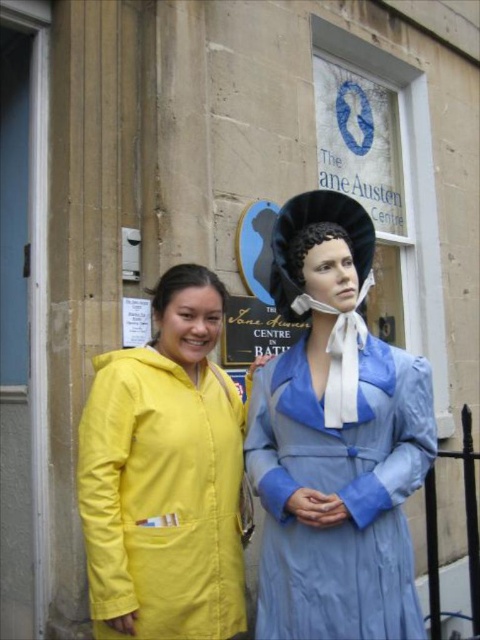
Consider the image. You are a tour guide at the Jane Austen Centre and need to direct visitors to the entrance. The entrance is located at point (165, 476). Where is the entrance located in relation to the yellow matte coat at center?

The entrance is located at the yellow matte coat at center, as point (165, 476) corresponds to the yellow matte coat at center.

In the scene shown: You are a tour guide at the Jane Austen Centre and need to point out the yellow matte coat at center to a visitor. Where exactly should you direct their attention using coordinates?

The yellow matte coat at center is located at coordinates point (x=165, y=476).

You are a costume designer preparing for a play. You need to decide which of the two outfits, the yellow matte coat at center or the light blue satin dress at center, would be more suitable for a character who needs to move freely in a scene involving quick movements. Based on their thickness, which would you choose?

The yellow matte coat at center is thinner than the light blue satin dress at center, so it would be more suitable for a character needing to move freely due to its lighter and less bulky material.